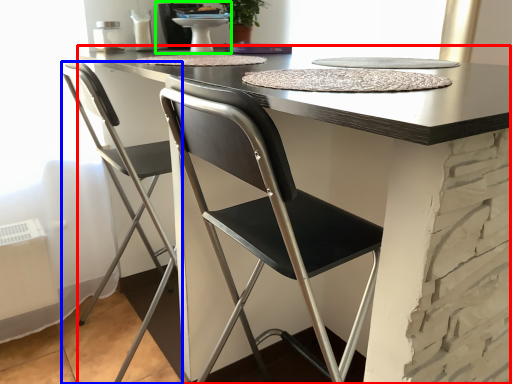
Question: Which is nearer to the table (highlighted by a red box)? chair (highlighted by a blue box) or sink (highlighted by a green box).

Choices:
 (A) chair
 (B) sink

Answer: (A)